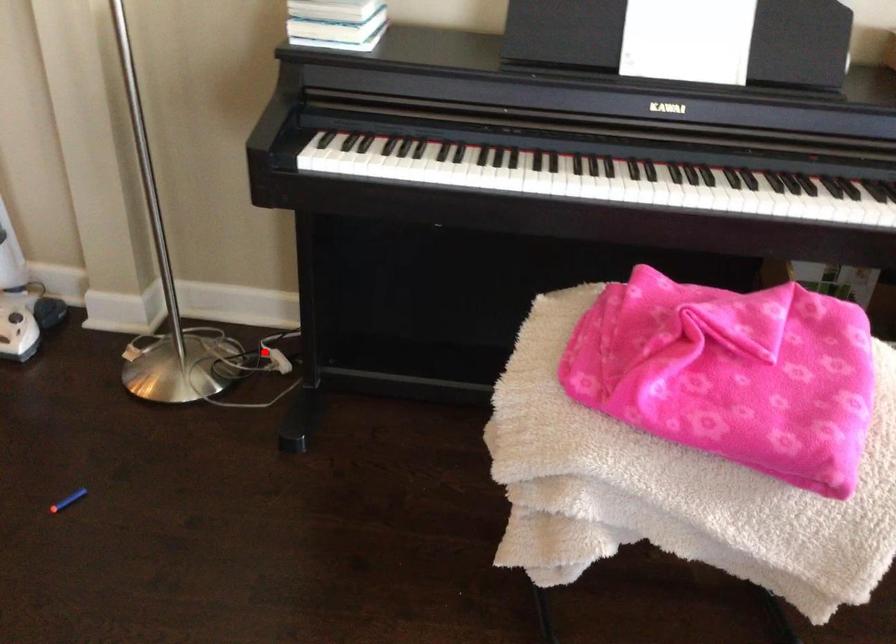
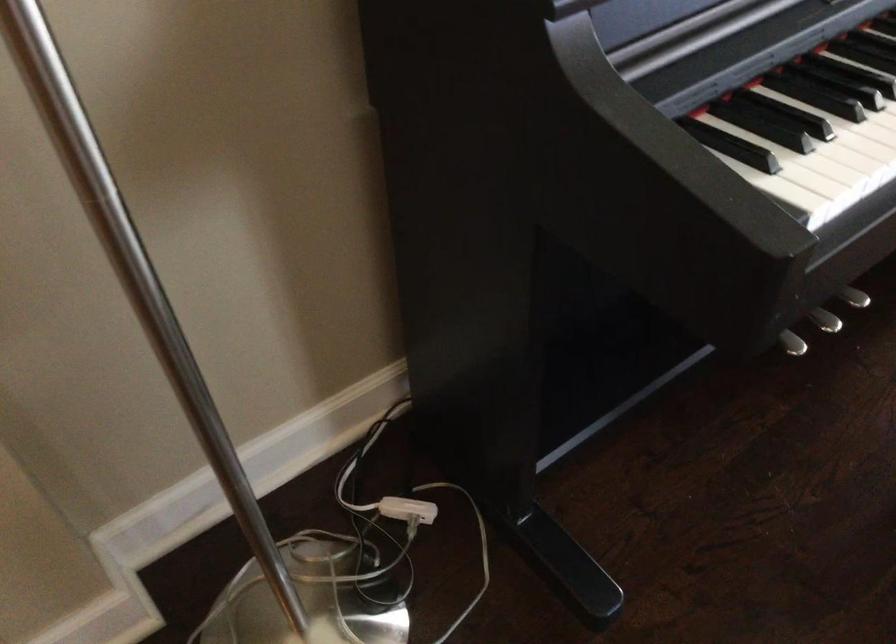
Question: I am providing you with two images of the same scene from different viewpoints. Image1 has a red point marked. In image2, the corresponding 3D location appears at what relative position? Reply with the corresponding letter.

Choices:
 (A) Closer
 (B) Farther

Answer: (A)